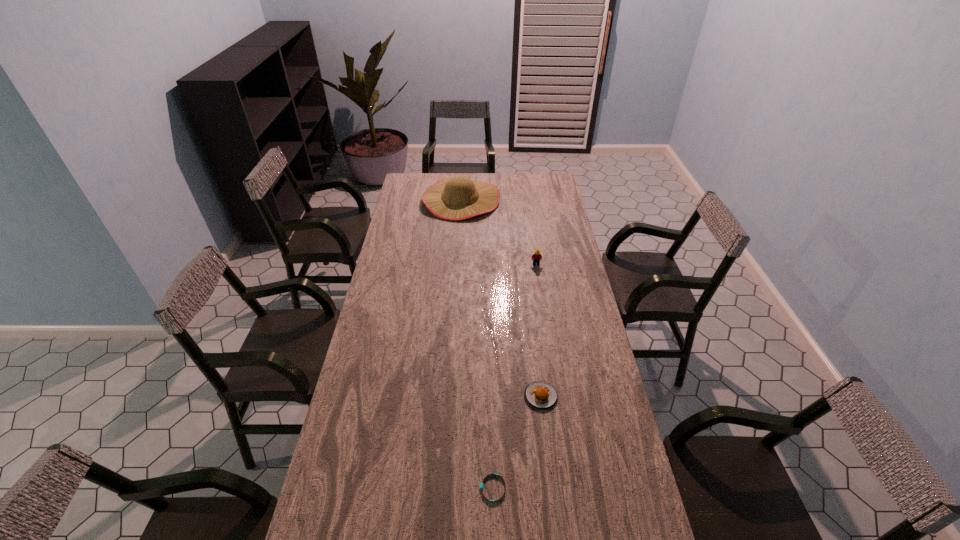
What are the coordinates of `the tallest object` in the screenshot? It's located at (458, 198).

Identify the location of sunhat. (458, 198).

In order to click on the second farthest object in this screenshot , I will do `click(536, 257)`.

Locate an element on the screen. This screenshot has width=960, height=540. the third shortest object is located at coordinates (536, 257).

Identify the location of the second shortest object. (541, 395).

Identify the location of the second nearest object. (541, 395).

Where is `the nearest object`? the nearest object is located at coordinates (481, 484).

Identify the location of wristband. pos(481,484).

This screenshot has height=540, width=960. I want to click on vacant space located on the right of the farthest object, so click(x=541, y=200).

Find the location of `vacant position located 0.230m on the front-facing side of the third nearest object`. vacant position located 0.230m on the front-facing side of the third nearest object is located at coordinates (541, 301).